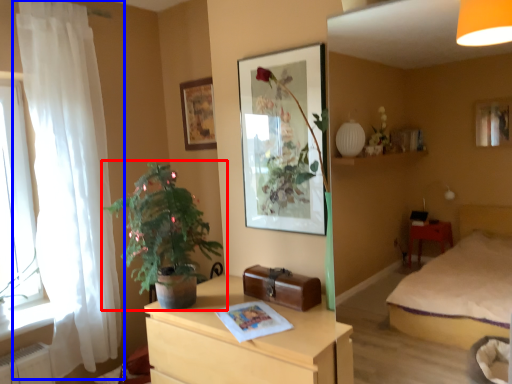
Question: Which point is further to the camera, houseplant (highlighted by a red box) or curtain (highlighted by a blue box)?

Choices:
 (A) houseplant
 (B) curtain

Answer: (B)